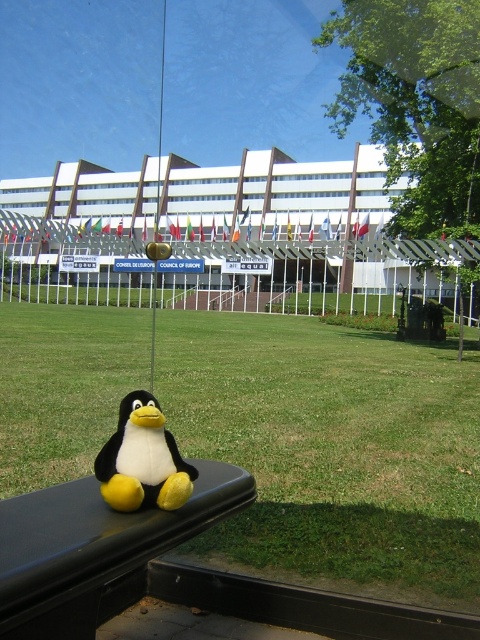
Does green grass at lower center have a greater width compared to white plush penguin at lower left?

Correct, the width of green grass at lower center exceeds that of white plush penguin at lower left.

Measure the distance between point (x=326, y=529) and camera.

A distance of 3.15 meters exists between point (x=326, y=529) and camera.

Which is behind, point (271, 396) or point (155, 477)?

The point (271, 396) is behind.

At what (x,y) coordinates should I click in order to perform the action: click on green grass at lower center. Please return your answer as a coordinate pair (x, y). The width and height of the screenshot is (480, 640). Looking at the image, I should click on (332, 449).

Is black plastic bench at lower left further to camera compared to white plush penguin at lower left?

That is False.

Can you confirm if black plastic bench at lower left is positioned to the left of white plush penguin at lower left?

Indeed, black plastic bench at lower left is positioned on the left side of white plush penguin at lower left.

Who is more distant from viewer, (131, 520) or (163, 465)?

Positioned behind is point (163, 465).

You are a GUI agent. You are given a task and a screenshot of the screen. Output one action in this format:
    pyautogui.click(x=<x>, y=<y>)
    Task: Click on the black plastic bench at lower left
    The height and width of the screenshot is (640, 480).
    Given the screenshot: What is the action you would take?
    [95, 550]

Can you confirm if green grass at lower center is thinner than black plastic bench at lower left?

In fact, green grass at lower center might be wider than black plastic bench at lower left.

Who is more distant from viewer, (74, 445) or (199, 483)?

Positioned behind is point (74, 445).

Between point (31, 330) and point (144, 584), which one is positioned in front?

Positioned in front is point (144, 584).

Where is `green grass at lower center`? The width and height of the screenshot is (480, 640). green grass at lower center is located at coordinates (332, 449).